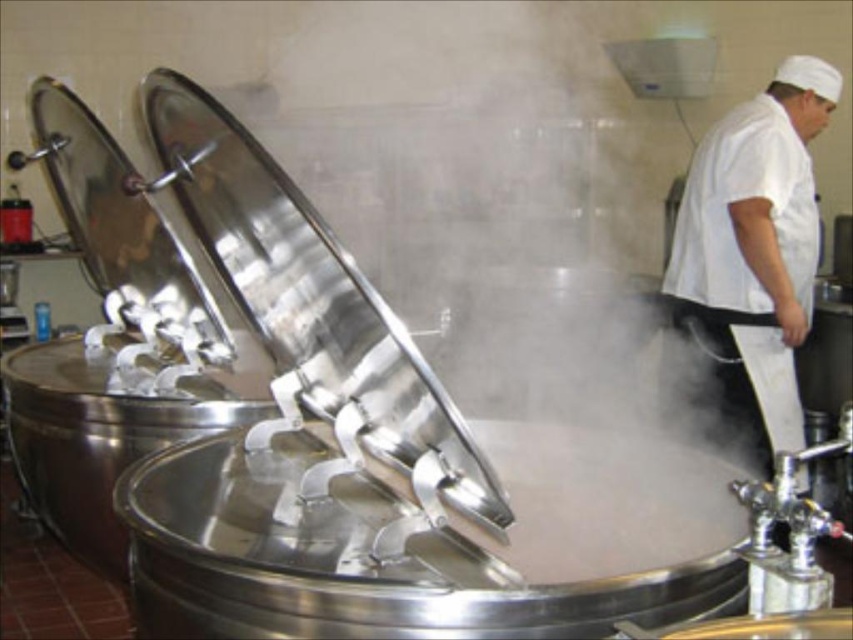
Is point (289, 308) more distant than point (770, 154)?

No, (289, 308) is closer to viewer.

Between point (383, 420) and point (787, 280), which one is positioned behind?

Point (787, 280)

Is point (302, 392) less distant than point (724, 248)?

Yes, point (302, 392) is in front of point (724, 248).

Where is `polished stainless steel exhaust hood at center`? This screenshot has width=853, height=640. polished stainless steel exhaust hood at center is located at coordinates (315, 305).